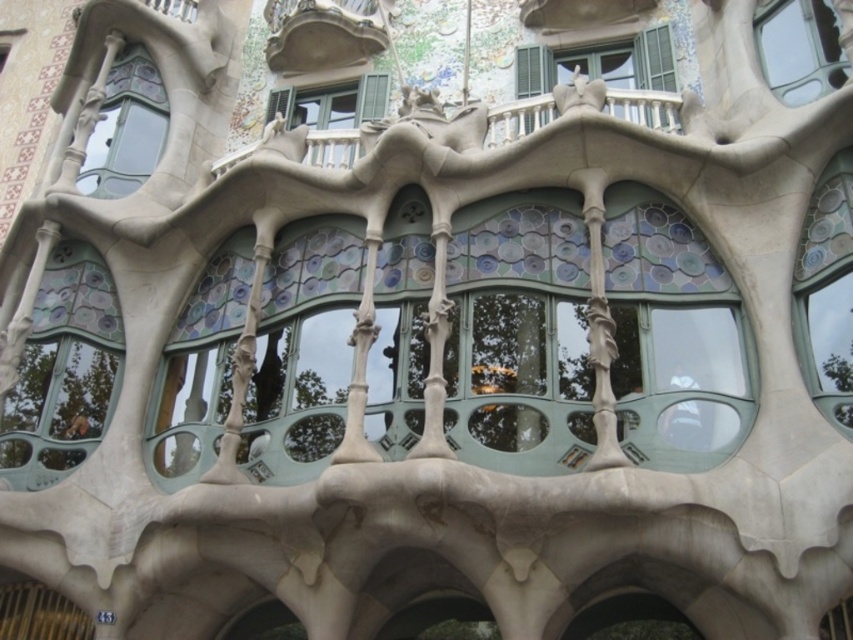
Can you confirm if translucent glass window at left is bigger than clear glass window at upper right?

Yes, translucent glass window at left is bigger than clear glass window at upper right.

Which is more to the right, translucent glass window at left or clear glass window at upper right?

clear glass window at upper right

Between point (93, 285) and point (809, 92), which one is positioned behind?

The point (93, 285) is more distant.

Find the location of a particular element. translucent glass window at left is located at coordinates (62, 371).

Can you confirm if translucent glass window at left is positioned below blue mosaic tiles at right?

Yes.

Does translucent glass window at left have a greater height compared to blue mosaic tiles at right?

Yes.

Does point (0, 458) come closer to viewer compared to point (822, 372)?

No, (0, 458) is behind (822, 372).

Locate an element on the screen. The width and height of the screenshot is (853, 640). translucent glass window at left is located at coordinates (62, 371).

Is point (659, 70) behind point (361, 106)?

No, (659, 70) is closer to viewer.

Does green matte window at upper center have a lesser width compared to matte glass window at upper center?

Incorrect, green matte window at upper center's width is not less than matte glass window at upper center's.

Is point (576, 60) positioned before point (320, 138)?

No, it is behind (320, 138).

Locate an element on the screen. The width and height of the screenshot is (853, 640). green matte window at upper center is located at coordinates (608, 74).